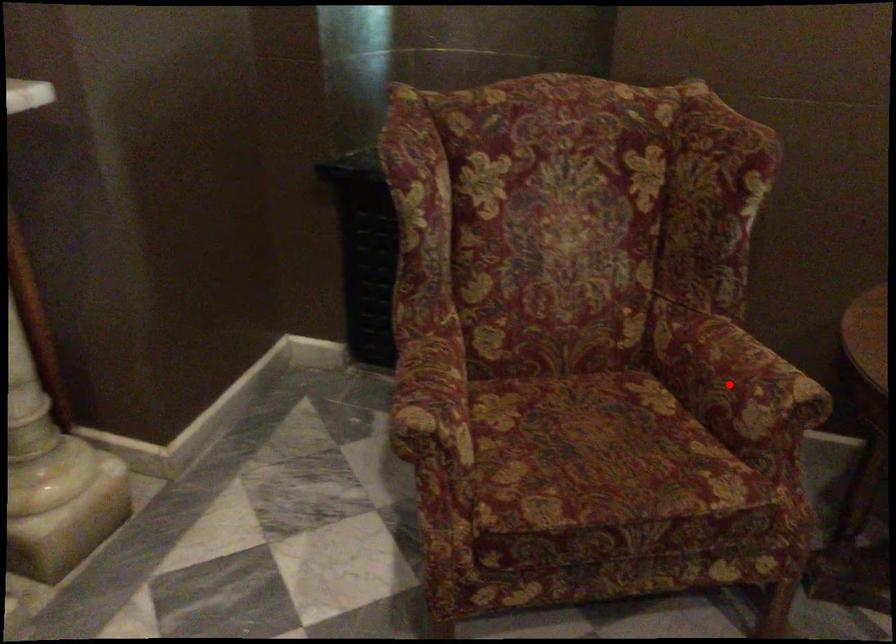
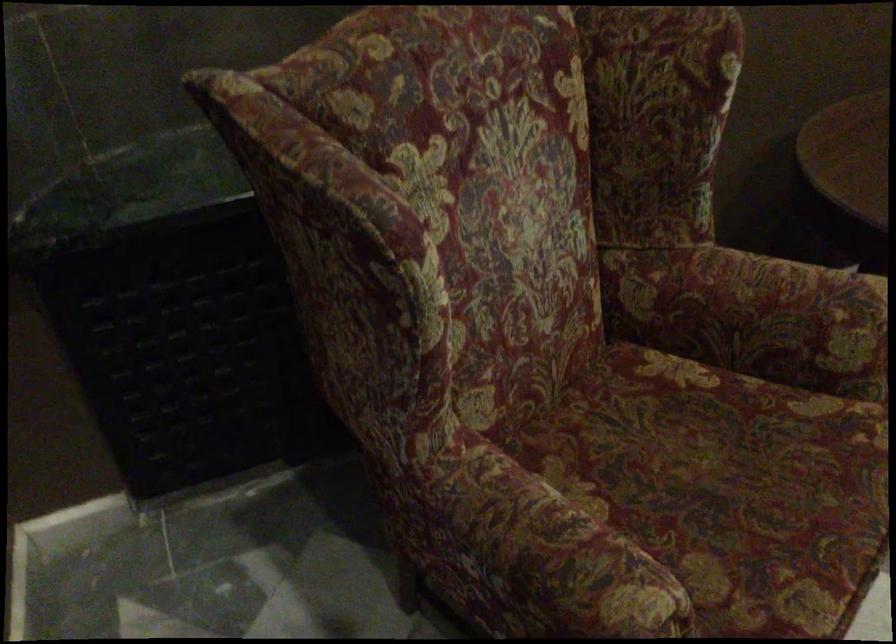
The point at the highlighted location is marked in the first image. Where is the corresponding point in the second image?

(786, 321)